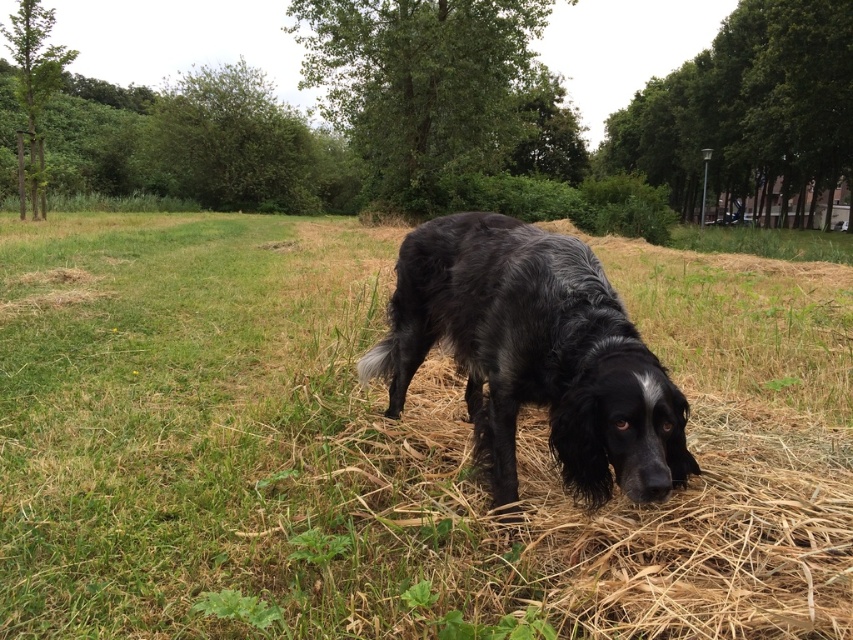
You are a photographer trying to capture the black fur dog at center and the black shaggy dog at center in a single shot. Which dog should you focus on first to ensure both are in the frame?

You should focus on the black fur dog at center first since it is in front of the black shaggy dog at center, ensuring both are visible in the frame.

You are a photographer trying to capture both the black fur dog at center and the black shaggy dog at center in the same frame. Given that your camera has a focal length of 50mm, which is suitable for capturing subjects within a 4 meter range, will you be able to include both dogs in your photo?

The black fur dog at center and black shaggy dog at center are 3.19 meters apart from each other, which is within the 4 meter range of the camera. Therefore, you can include both dogs in your photo.